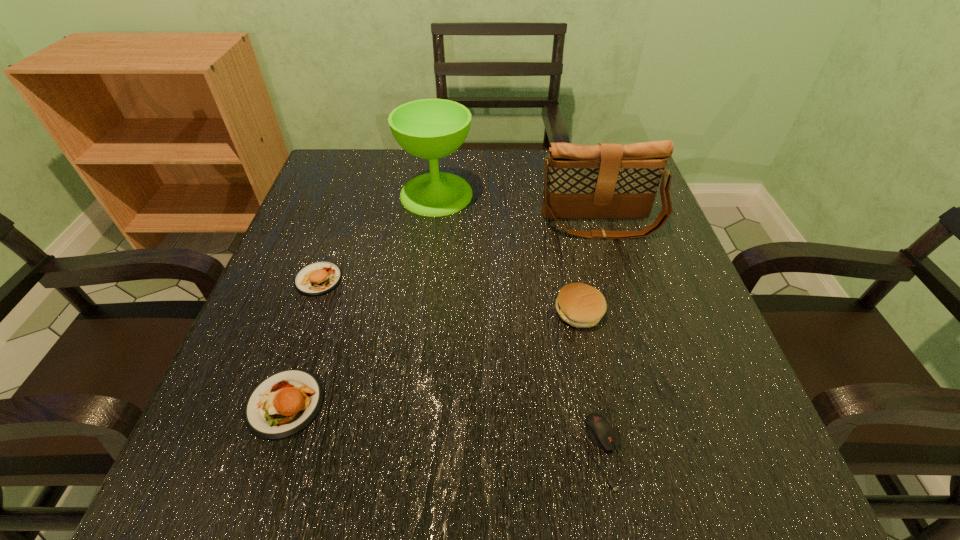
At what (x,y) coordinates should I click in order to perform the action: click on wineglass. Please return your answer as a coordinate pair (x, y). Looking at the image, I should click on (431, 129).

Where is `shoulder bag`? The image size is (960, 540). shoulder bag is located at coordinates (605, 181).

You are a GUI agent. You are given a task and a screenshot of the screen. Output one action in this format:
    pyautogui.click(x=<x>, y=<y>)
    Task: Click on the rightmost patty (food)
    This screenshot has height=540, width=960.
    Given the screenshot: What is the action you would take?
    pyautogui.click(x=580, y=305)

Locate an element on the screen. The image size is (960, 540). the second shortest object is located at coordinates (283, 404).

This screenshot has height=540, width=960. What are the coordinates of `the nearest patty (food)` in the screenshot? It's located at (283, 404).

In order to click on the shortest object in this screenshot , I will do `click(601, 433)`.

The width and height of the screenshot is (960, 540). What are the coordinates of `free location located on the front of the third object from left to right` in the screenshot? It's located at (422, 313).

Identify the location of vacant space located on the front-facing side of the shoulder bag. (619, 289).

Where is `free space located on the left of the rightmost patty (food)`? This screenshot has height=540, width=960. free space located on the left of the rightmost patty (food) is located at coordinates 346,312.

Identify the location of free space located 0.130m on the back of the fifth tallest object. The width and height of the screenshot is (960, 540). tap(317, 309).